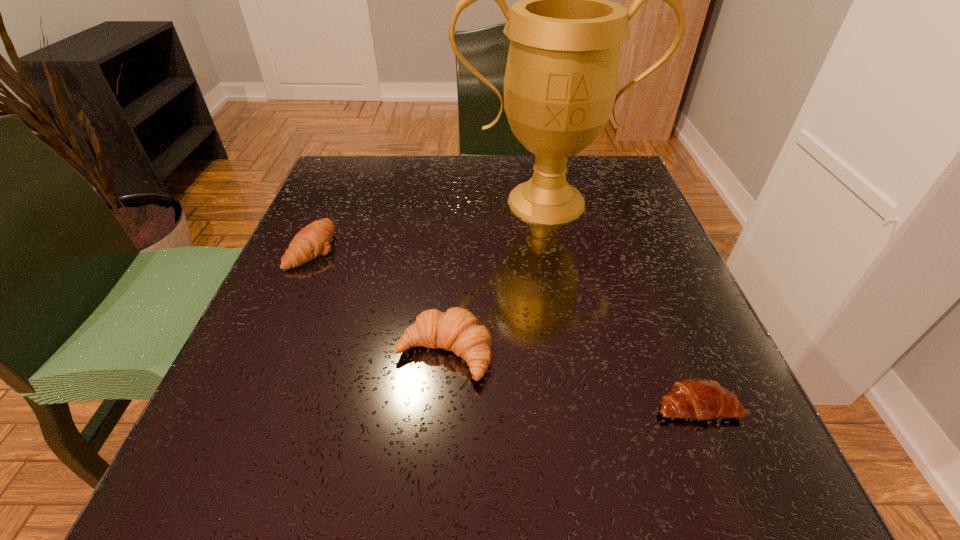
Where is `the tallest object`? Image resolution: width=960 pixels, height=540 pixels. the tallest object is located at coordinates point(561,80).

This screenshot has width=960, height=540. In order to click on the third shortest object in this screenshot , I will do `click(457, 330)`.

The width and height of the screenshot is (960, 540). What are the coordinates of `the tallest crescent roll` in the screenshot? It's located at (457, 330).

The height and width of the screenshot is (540, 960). I want to click on the leftmost object, so point(314,239).

Identify the location of the farthest crescent roll. This screenshot has width=960, height=540. (314, 239).

This screenshot has width=960, height=540. In order to click on the shortest object in this screenshot , I will do `click(698, 398)`.

You are a GUI agent. You are given a task and a screenshot of the screen. Output one action in this format:
    pyautogui.click(x=<x>, y=<y>)
    Task: Click on the rightmost crescent roll
    
    Given the screenshot: What is the action you would take?
    pyautogui.click(x=698, y=398)

The image size is (960, 540). Identify the location of free location located on the engravings side of the tallest object. (563, 286).

Identify the location of free space located on the right of the third shortest object. (589, 354).

Identify the location of free space located on the front of the leftmost object. (204, 500).